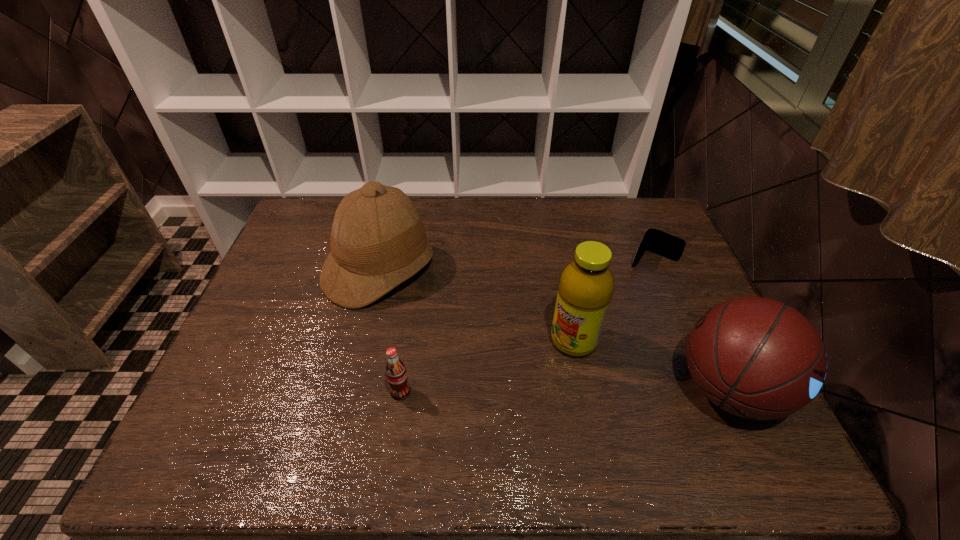
Find the location of a particular element. wallet at the right edge is located at coordinates (656, 241).

At what (x,y) coordinates should I click in order to perform the action: click on object that is at the near right corner. Please return your answer as a coordinate pair (x, y). Looking at the image, I should click on (757, 358).

Identify the location of free space at the far edge of the desktop. (606, 239).

Identify the location of vacant space at the left edge. (296, 298).

Identify the location of vacant space at the right edge. The width and height of the screenshot is (960, 540). (696, 319).

You are a GUI agent. You are given a task and a screenshot of the screen. Output one action in this format:
    pyautogui.click(x=<x>, y=<y>)
    Task: Click on the free space at the far left corner of the desktop
    
    Given the screenshot: What is the action you would take?
    pyautogui.click(x=304, y=207)

The image size is (960, 540). Identify the location of empty space between the wallet and the basketball. (691, 324).

Identify the location of vacant space that is in between the shortest object and the fruit juice. The height and width of the screenshot is (540, 960). (613, 300).

I want to click on vacant space in between the second shortest object and the fruit juice, so click(x=487, y=366).

Locate an element on the screen. The height and width of the screenshot is (540, 960). free space between the wallet and the soda is located at coordinates (526, 326).